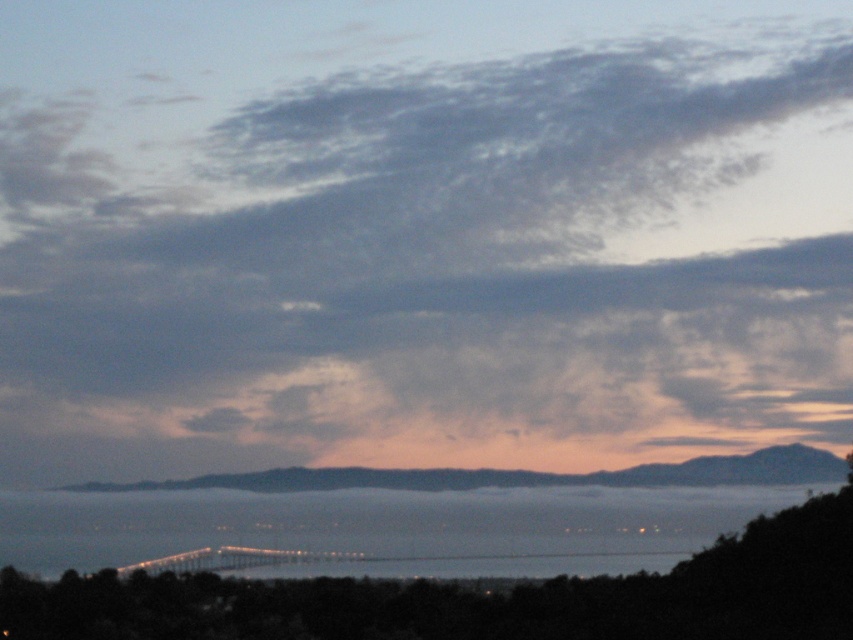
Does blue water at center have a larger size compared to metallic gray bridge at center?

Correct, blue water at center is larger in size than metallic gray bridge at center.

Who is more forward, (520, 497) or (547, 573)?

Positioned in front is point (520, 497).

Is point (398, 492) positioned behind point (514, 557)?

No, it is in front of (514, 557).

Where is `blue water at center`? This screenshot has height=640, width=853. blue water at center is located at coordinates (386, 525).